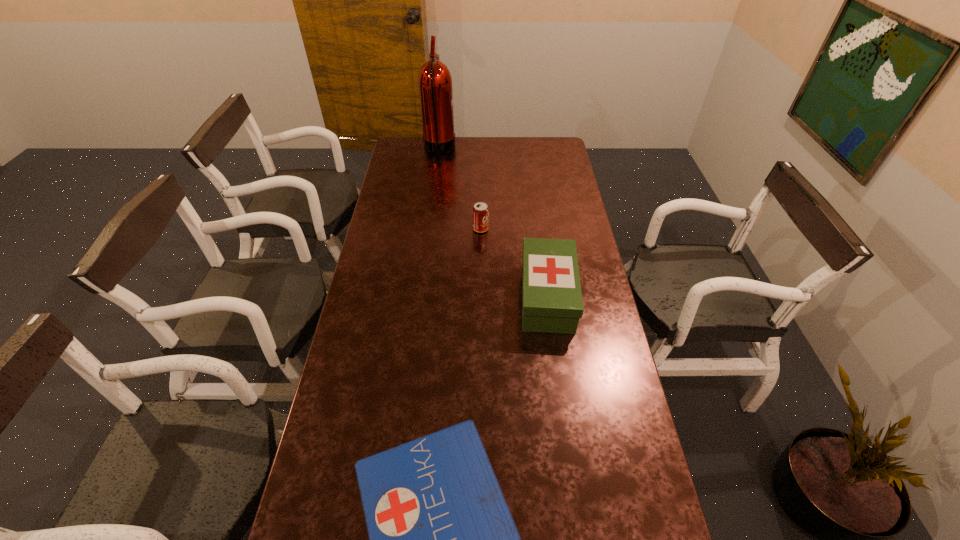
This screenshot has width=960, height=540. What are the coordinates of `free space that satisfies the following two spatial constraints: 1. on the front-facing side of the farthest object; 2. on the right side of the second nearest object` in the screenshot? It's located at (421, 297).

You are a GUI agent. You are given a task and a screenshot of the screen. Output one action in this format:
    pyautogui.click(x=<x>, y=<y>)
    Task: Click on the free location that satisfies the following two spatial constraints: 1. on the front-facing side of the fire extinguisher; 2. on the right side of the soda can
    
    Given the screenshot: What is the action you would take?
    pyautogui.click(x=429, y=229)

In order to click on free space that satisfies the following two spatial constraints: 1. on the front-facing side of the tallest object; 2. on the back side of the third nearest object in this screenshot , I will do `click(429, 229)`.

I want to click on vacant region that satisfies the following two spatial constraints: 1. on the front-facing side of the second farthest object; 2. on the left side of the fire extinguisher, so click(x=429, y=229).

The height and width of the screenshot is (540, 960). Identify the location of free space that satisfies the following two spatial constraints: 1. on the front-facing side of the second farthest object; 2. on the right side of the fire extinguisher. (429, 229).

Find the location of a particular element. Image resolution: width=960 pixels, height=540 pixels. vacant space that satisfies the following two spatial constraints: 1. on the front-facing side of the farther first-aid kit; 2. on the right side of the tallest object is located at coordinates (421, 297).

I want to click on free spot that satisfies the following two spatial constraints: 1. on the front-facing side of the soda can; 2. on the right side of the tallest object, so click(429, 229).

You are a GUI agent. You are given a task and a screenshot of the screen. Output one action in this format:
    pyautogui.click(x=<x>, y=<y>)
    Task: Click on the free spot that satisfies the following two spatial constraints: 1. on the front-facing side of the tallest object; 2. on the right side of the right first-aid kit
    
    Given the screenshot: What is the action you would take?
    pyautogui.click(x=421, y=297)